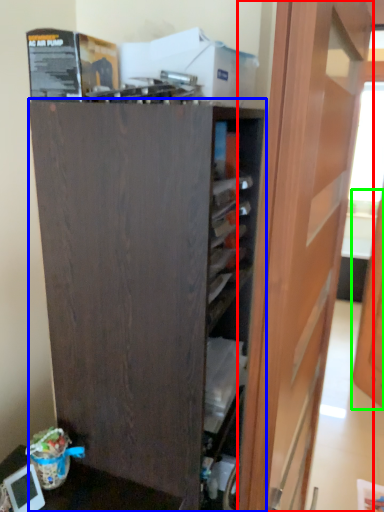
Question: Estimate the real-world distances between objects in this image. Which object is closer to door (highlighted by a red box), cupboard (highlighted by a blue box) or door (highlighted by a green box)?

Choices:
 (A) cupboard
 (B) door

Answer: (A)